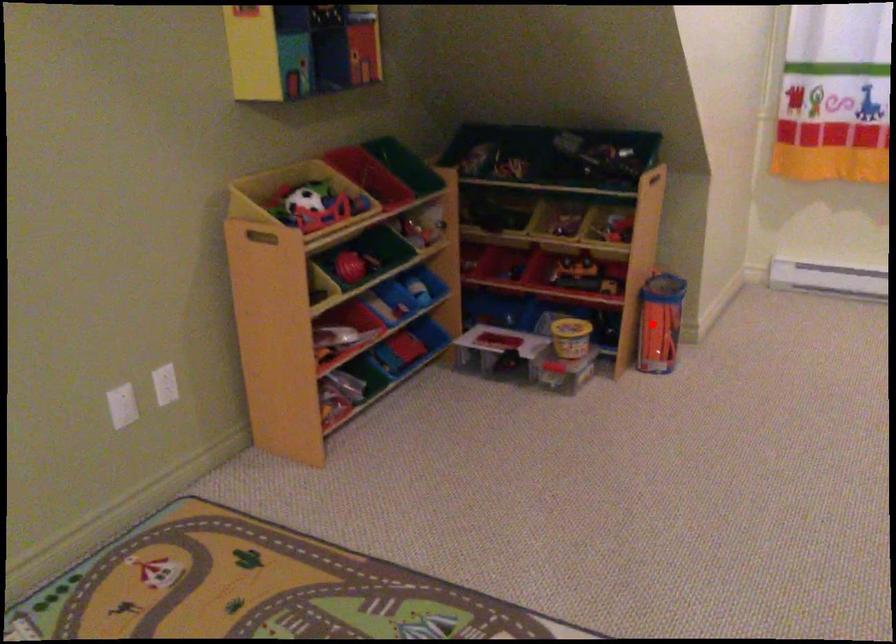
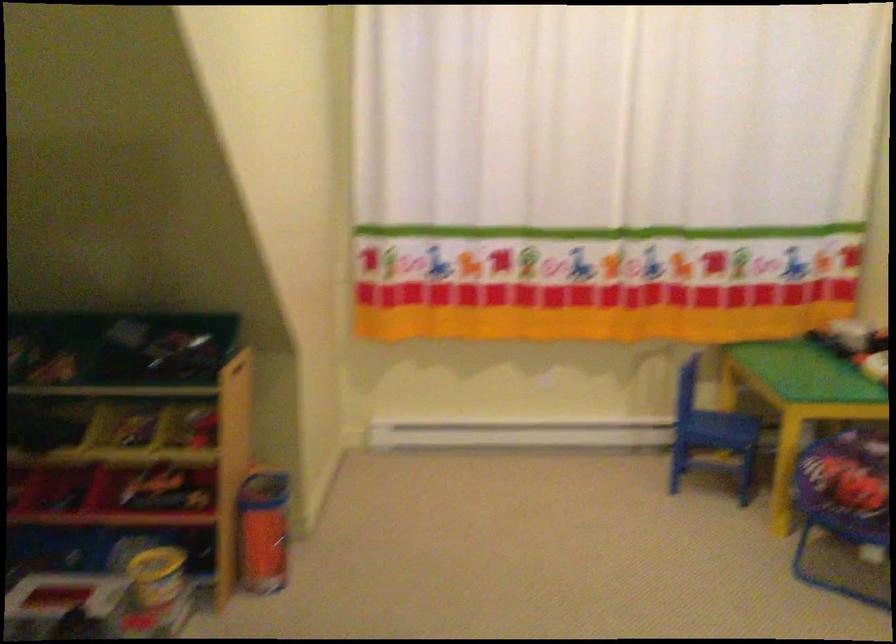
Question: I am providing you with two images of the same scene from different viewpoints. Given a red point in image1, look at the same physical point in image2. Is it:

Choices:
 (A) Closer to the viewpoint
 (B) Farther from the viewpoint

Answer: (A)